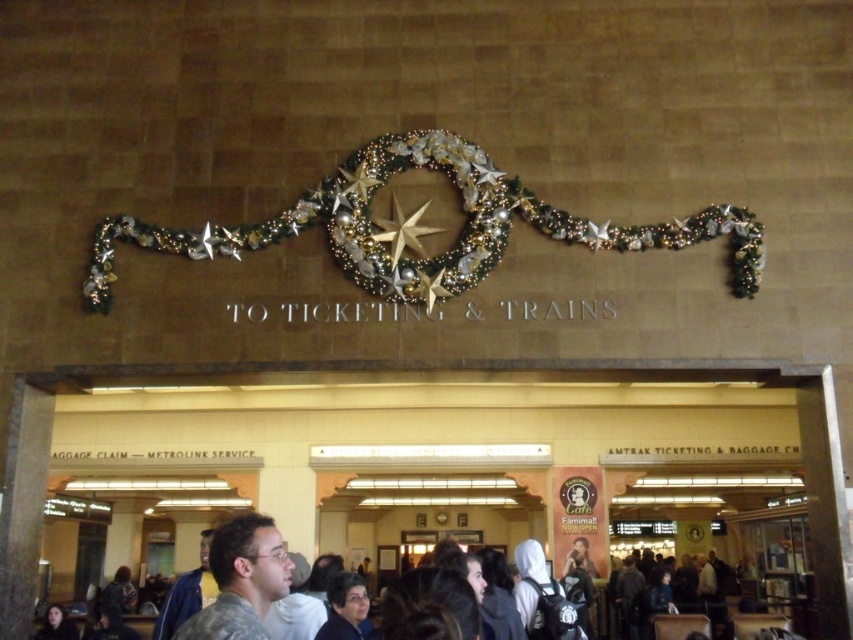
From the picture: You are standing at the entrance of the train station and see two points marked on the floor. The first point is labeled as point (210, 557) and the second is point (405, 241). If you want to move from the first point to the second point, which direction should you face to walk towards the correct path?

To move from point (210, 557) to point (405, 241), you should face towards the direction where the second point is located. Since point (210, 557) is in front of point (405, 241), you need to walk backward or turn around to head towards the second point.

You are standing at the entrance of the train station and notice a camouflage fabric shirt at center and a gold metallic star at center. Which object is farther from you?

The camouflage fabric shirt at center is 67.78 feet away from the gold metallic star at center, so the camouflage fabric shirt at center is farther from you.

Based on the photo, you are standing at the entrance of the train station and see both the camouflage fabric shirt at center and the gold metallic star at center. Which object is nearer to you?

The camouflage fabric shirt at center is closer to the viewer than the gold metallic star at center.